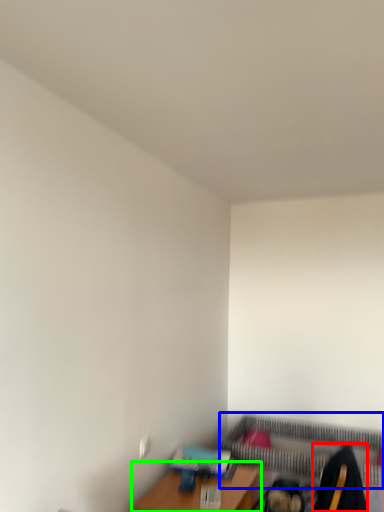
Question: Which object is positioned farthest from swivel chair (highlighted by a red box)? Select from bed frame (highlighted by a blue box) and table (highlighted by a green box).

Choices:
 (A) bed frame
 (B) table

Answer: (A)